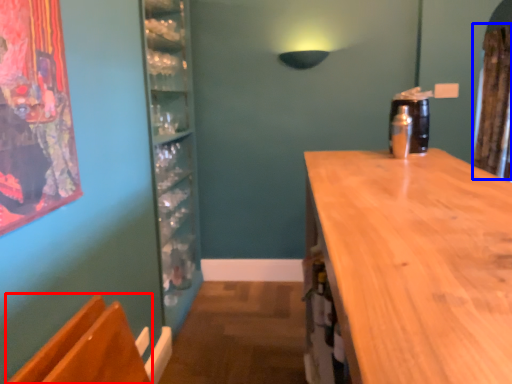
Question: Which object is further to the camera taking this photo, armchair (highlighted by a red box) or curtain (highlighted by a blue box)?

Choices:
 (A) armchair
 (B) curtain

Answer: (B)